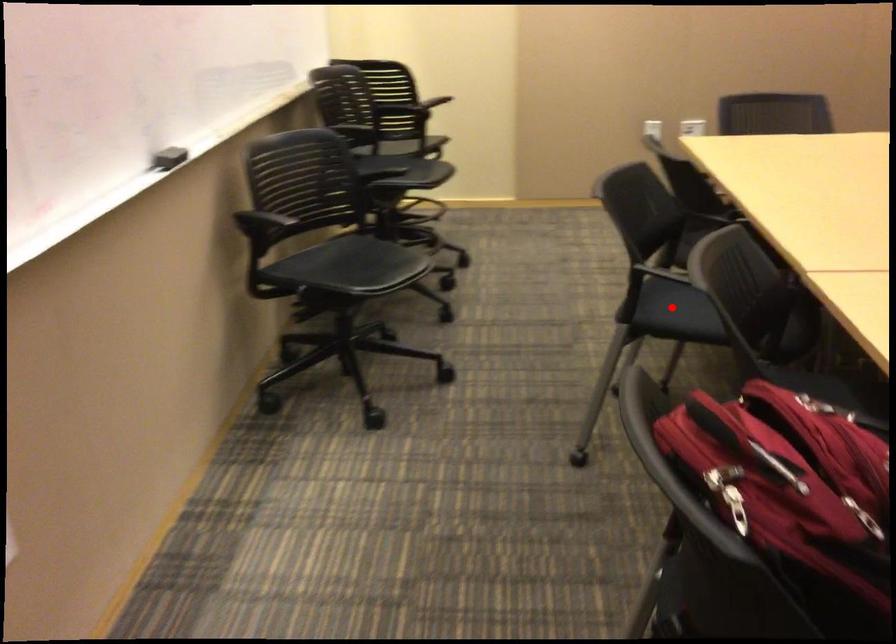
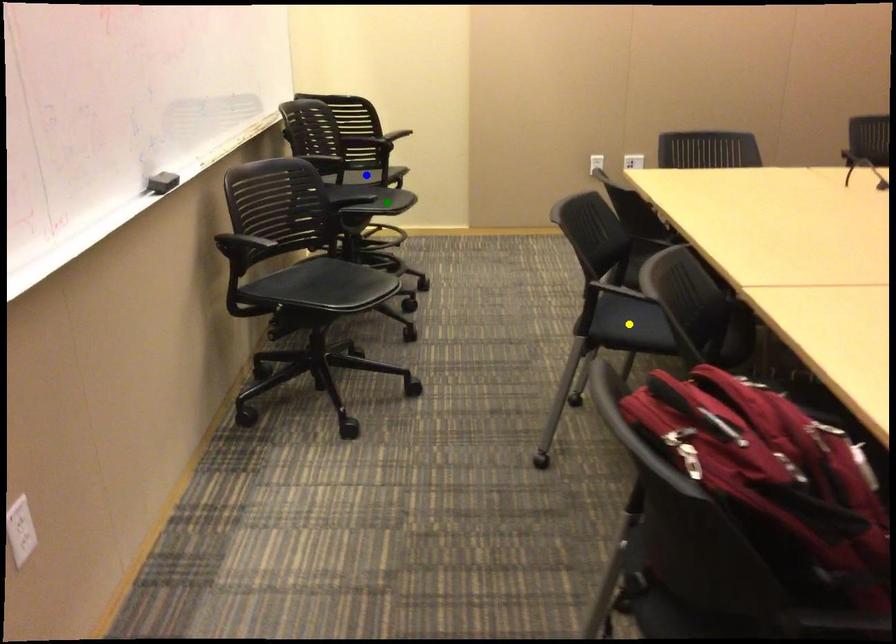
Question: I am providing you with two images of the same scene from different viewpoints. A red point is marked on the first image. You are given multiple points on the second image. Which point in image 2 represents the same 3d spot as the red point in image 1?

Choices:
 (A) yellow point
 (B) blue point
 (C) green point

Answer: (A)